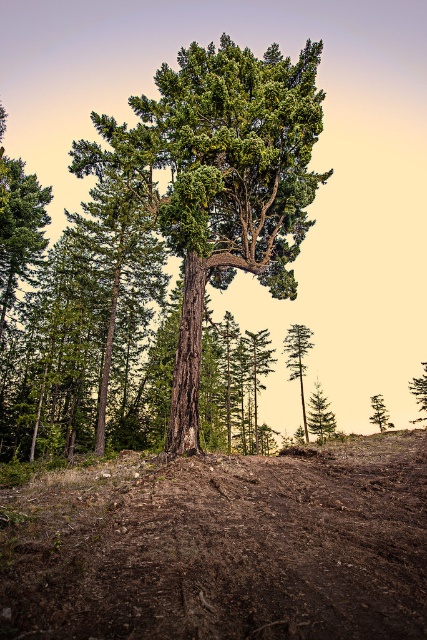
You are a landscape architect designing a garden and need to place two trees. You have a green textured tree at center and a green matte tree at upper center. Which tree has a wider base?

The green textured tree at center has a larger width than the green matte tree at upper center, so the green textured tree at center has a wider base.